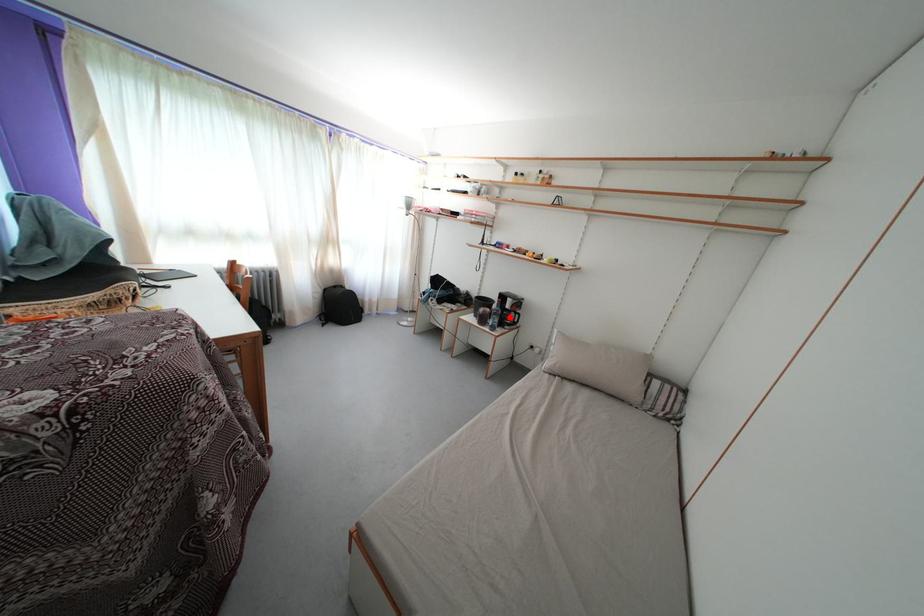
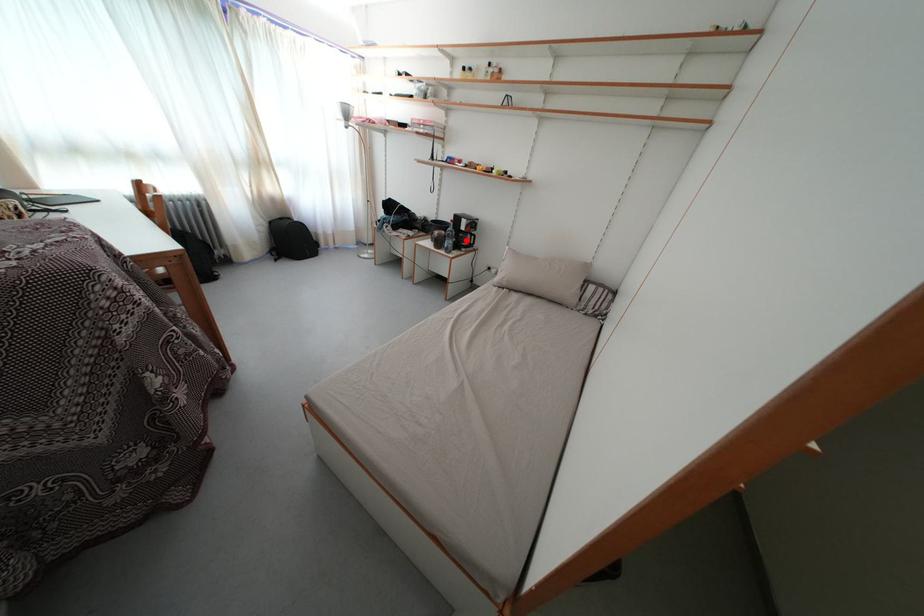
I am providing you with two images of the same scene from different viewpoints. A red point is marked on the first image and another point is marked on the second image. Is the red point in image1 aligned with the point shown in image2?

Yes